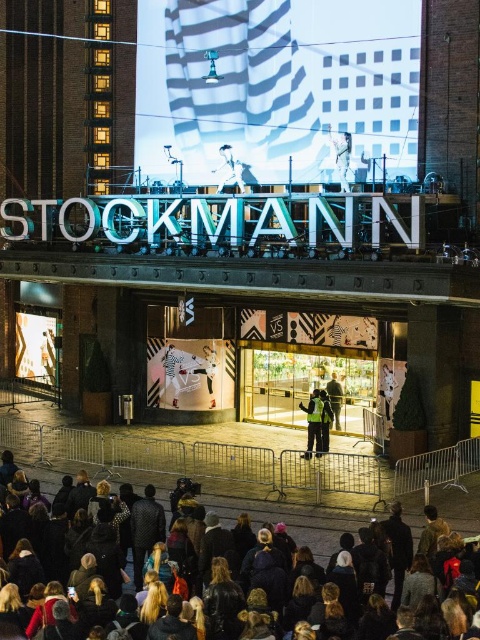
Does point (434, 490) come farther from viewer compared to point (337, 392)?

No, (434, 490) is in front of (337, 392).

Is black leather jackets at lower center further to the viewer compared to light brown leather jacket at center?

No, it is in front of light brown leather jacket at center.

Consider the image. Who is more distant from viewer, [455,529] or [333,412]?

The point [333,412] is behind.

What are the coordinates of `black leather jackets at lower center` in the screenshot? It's located at (294, 513).

Who is shorter, reflective yellow vest at center or dark gray jacket at center?

reflective yellow vest at center is shorter.

Consider the image. Is reflective yellow vest at center further to the viewer compared to dark gray jacket at center?

That is True.

What do you see at coordinates (312, 422) in the screenshot? The image size is (480, 640). I see `reflective yellow vest at center` at bounding box center [312, 422].

I want to click on reflective yellow vest at center, so click(312, 422).

Does point (371, 513) come in front of point (324, 388)?

Yes, it is in front of point (324, 388).

Who is more distant from viewer, (328, 456) or (332, 422)?

The point (332, 422) is behind.

Does point (137, 488) come closer to viewer compared to point (323, 422)?

Yes, it is in front of point (323, 422).

This screenshot has width=480, height=640. What are the coordinates of `black leather jackets at lower center` in the screenshot? It's located at (294, 513).